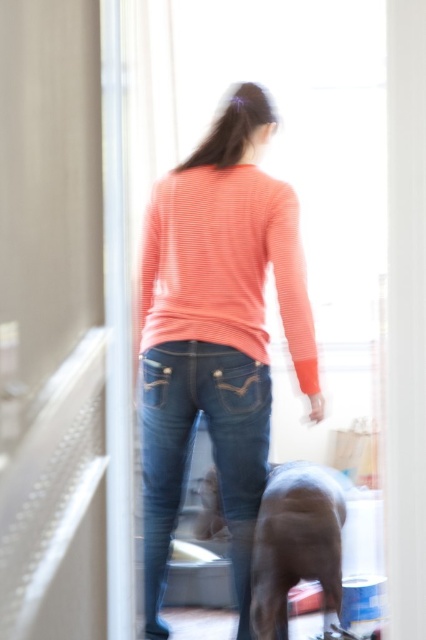
You are standing in the doorway and notice two points marked in the scene. Which point is closer to you, point (229, 218) or point (282, 477)?

Point (229, 218) is closer to the camera than point (282, 477).

You are standing in the doorway and want to place a small plant exactly where the matte coral sweater at center is located. What coordinates should you aim for?

You should aim for the coordinates point at (216, 332) where the matte coral sweater at center is located.

In the scene shown: You are standing in a room and see a person and a dog through the doorway. The person is wearing a coral sweater and dark blue jeans. The dog is in front of the person. There is a point marked at coordinates (216, 332). What is located at that point?

The point at coordinates (216, 332) has the matte coral sweater at center.